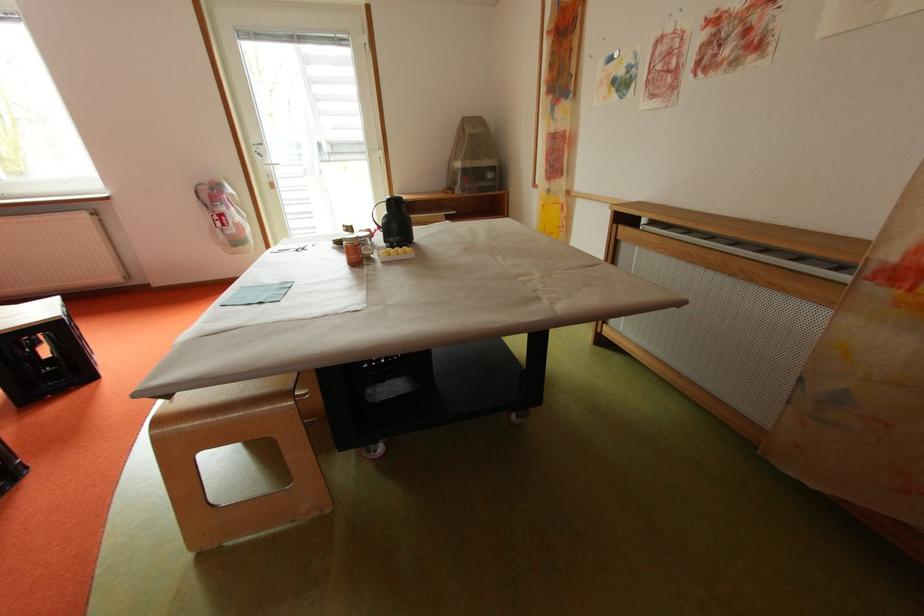
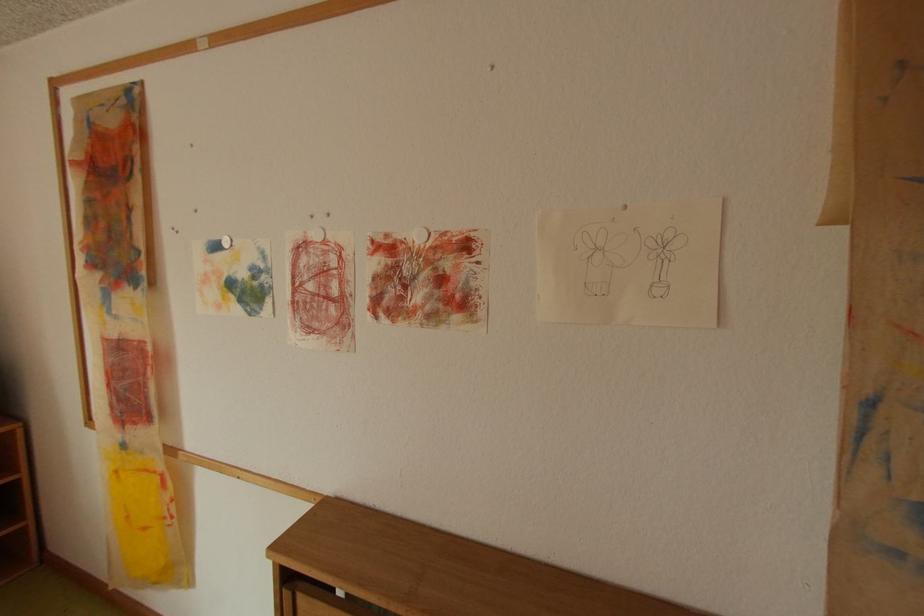
The point at (659, 74) is marked in the first image. Where is the corresponding point in the second image?

(304, 292)